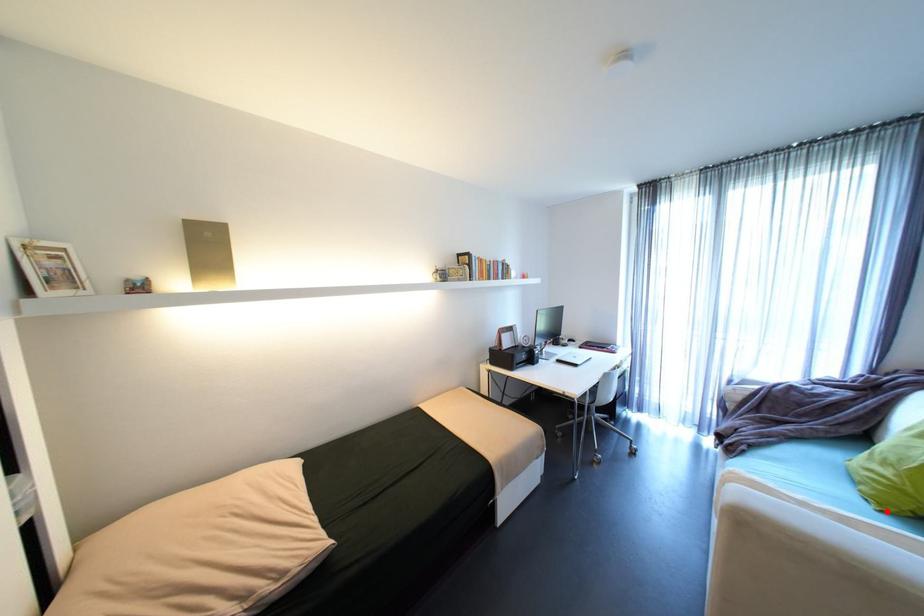
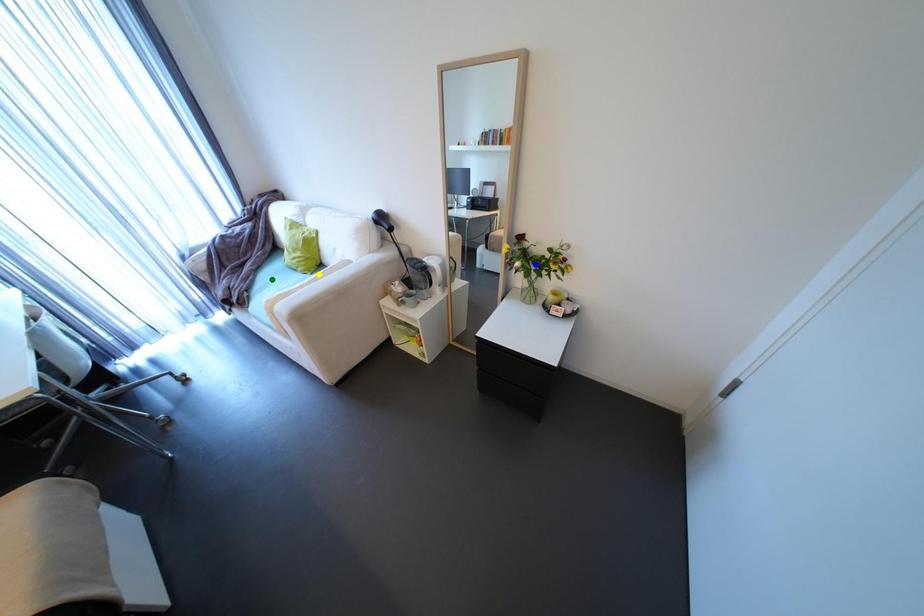
Question: I am providing you with two images of the same scene from different viewpoints. A red point is marked on the first image. You are given multiple points on the second image. Which mark in image 2 goes with the point in image 1?

Choices:
 (A) blue point
 (B) green point
 (C) yellow point

Answer: (C)